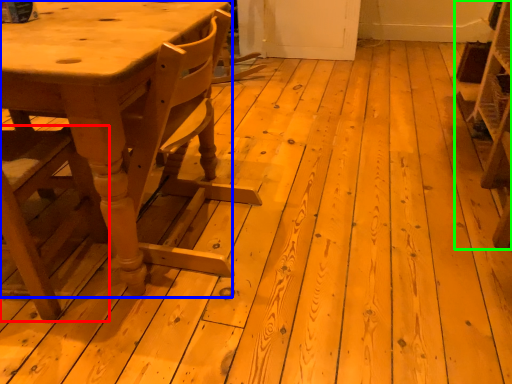
Question: Which object is the closest to the chair (highlighted by a red box)? Choose among these: table (highlighted by a blue box) or shelf (highlighted by a green box).

Choices:
 (A) table
 (B) shelf

Answer: (A)